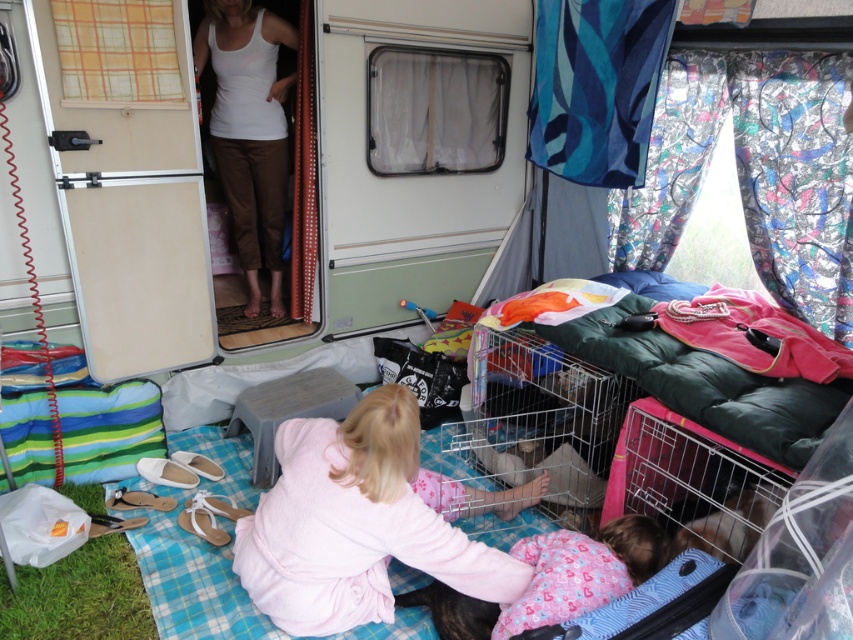
You are organizing the items in the caravan. You need to place the pink fleece blanket at lower center and the white matte tank top at upper center. According to their current positions, which item is located to the right of the other?

The pink fleece blanket at lower center is positioned on the right side of white matte tank top at upper center.

You are standing inside the caravan and want to place a small toy on the pink fleece blanket at lower center. According to the coordinates provided, where should you place the toy?

The pink fleece blanket at lower center is located at coordinates point (360, 522), so you should place the toy there.